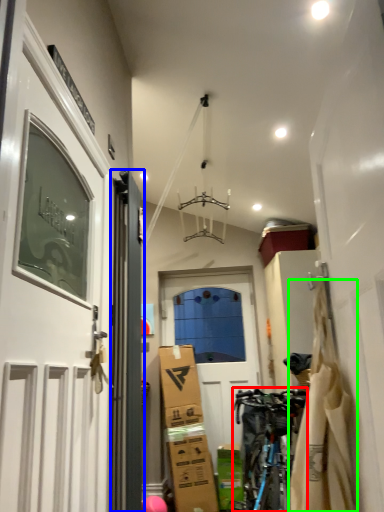
Question: Which object is positioned closest to bicycle (highlighted by a red box)? Select from door (highlighted by a blue box) and material (highlighted by a green box).

Choices:
 (A) door
 (B) material

Answer: (A)